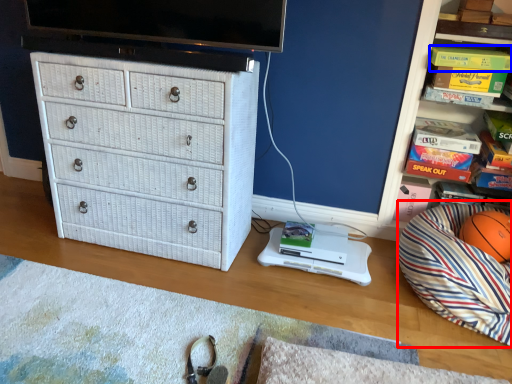
Question: Which object appears closest to the camera in this image, bean bag chair (highlighted by a red box) or book (highlighted by a blue box)?

Choices:
 (A) bean bag chair
 (B) book

Answer: (A)